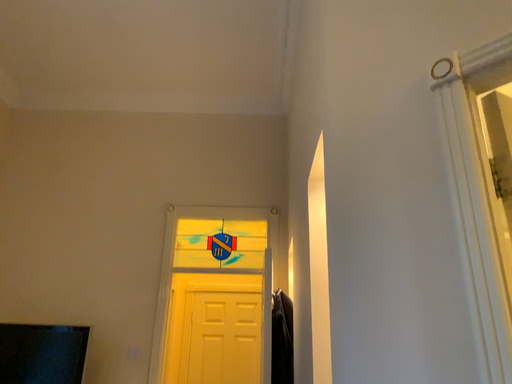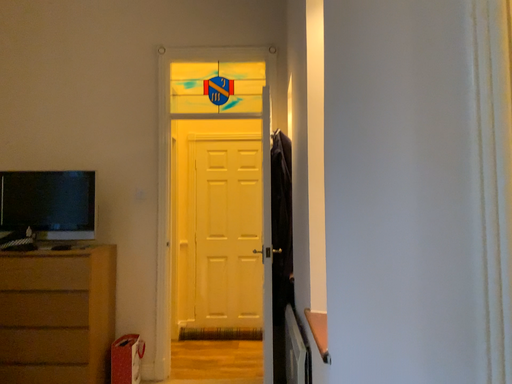
Question: Which way did the camera rotate in the video?

Choices:
 (A) rotated downward
 (B) rotated upward

Answer: (A)